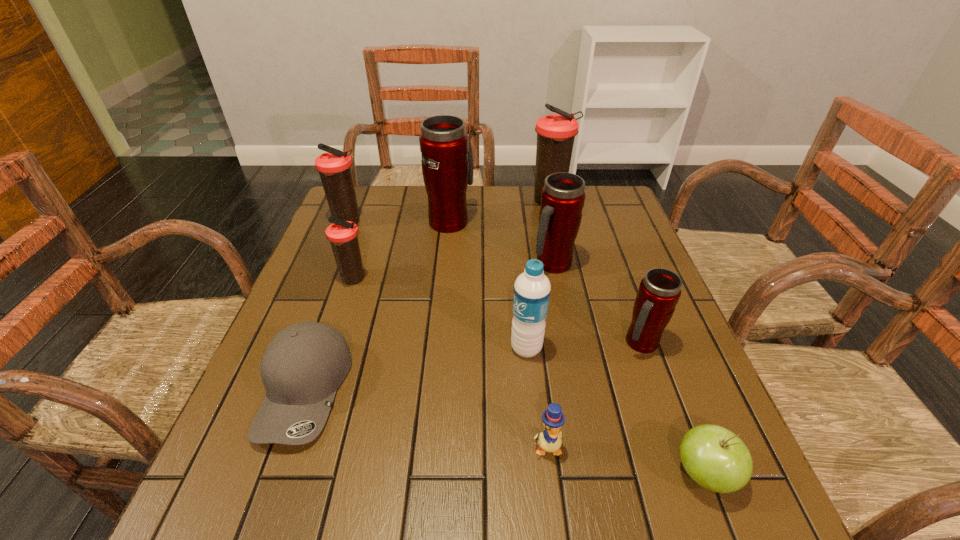
Identify the location of vacant region located on the label of the water bottle. The image size is (960, 540). (459, 348).

Locate an element on the screen. This screenshot has width=960, height=540. free point located on the side with the handle of the smallest red thermos bottle is located at coordinates (681, 455).

At what (x,y) coordinates should I click in order to perform the action: click on vacant space located 0.390m on the back of the nearest brown thermos bottle. Please return your answer as a coordinate pair (x, y). Looking at the image, I should click on (382, 192).

Where is `vacant space situated on the front brim of the baseball cap`? Image resolution: width=960 pixels, height=540 pixels. vacant space situated on the front brim of the baseball cap is located at coordinates (270, 494).

This screenshot has height=540, width=960. Find the location of `free location located 0.300m on the left of the green apple`. free location located 0.300m on the left of the green apple is located at coordinates (494, 474).

At what (x,y) coordinates should I click in order to perform the action: click on vacant space situated on the face of the duckling, where the monocle is placed. Please return your answer as a coordinate pair (x, y). The height and width of the screenshot is (540, 960). Looking at the image, I should click on (554, 509).

The height and width of the screenshot is (540, 960). In order to click on object that is at the near edge in this screenshot , I will do tap(714, 457).

Locate an element on the screen. The height and width of the screenshot is (540, 960). baseball cap that is positioned at the left edge is located at coordinates (304, 364).

The height and width of the screenshot is (540, 960). In order to click on apple that is positioned at the right edge in this screenshot , I will do `click(714, 457)`.

This screenshot has height=540, width=960. I want to click on object present at the far left corner, so click(334, 167).